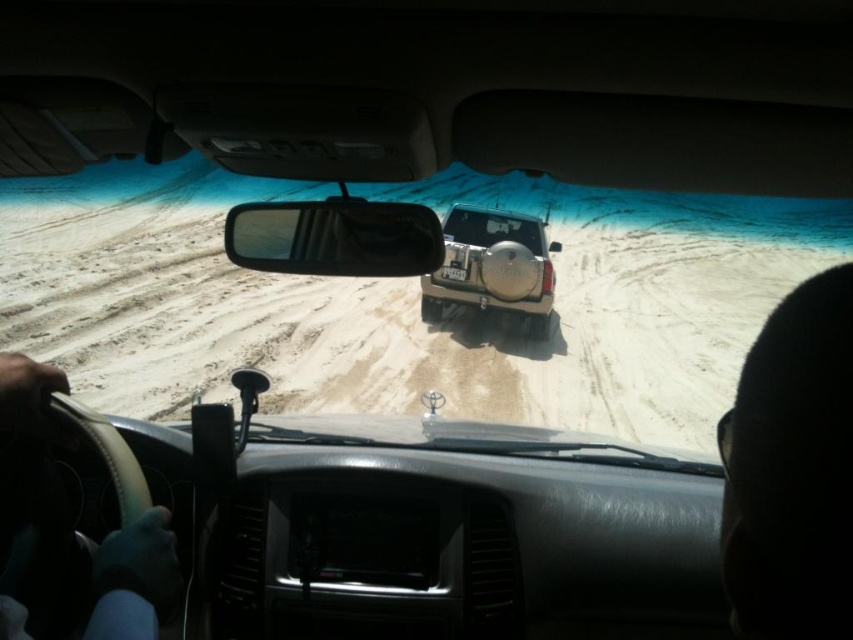
Can you confirm if black hair at upper right is bigger than black plastic license plate at rear?

Correct, black hair at upper right is larger in size than black plastic license plate at rear.

Is black hair at upper right below black plastic license plate at rear?

Correct, black hair at upper right is located below black plastic license plate at rear.

Does point (846, 624) come closer to viewer compared to point (447, 269)?

Yes.

Identify the location of black hair at upper right. (792, 468).

Does black hair at upper right have a greater width compared to matte beige jeep at center?

In fact, black hair at upper right might be narrower than matte beige jeep at center.

Does black hair at upper right appear under matte beige jeep at center?

Correct, black hair at upper right is located below matte beige jeep at center.

Does point (820, 390) come behind point (525, 218)?

That is False.

Locate an element on the screen. black hair at upper right is located at coordinates (792, 468).

Which of these two, clear plastic windshield at center or clear glass windshield at center, stands shorter?

With less height is clear plastic windshield at center.

Is clear plastic windshield at center shorter than clear glass windshield at center?

Yes.

Describe the element at coordinates (334, 237) in the screenshot. The image size is (853, 640). I see `clear plastic windshield at center` at that location.

Find the location of a particular element. Image resolution: width=853 pixels, height=640 pixels. clear plastic windshield at center is located at coordinates (334, 237).